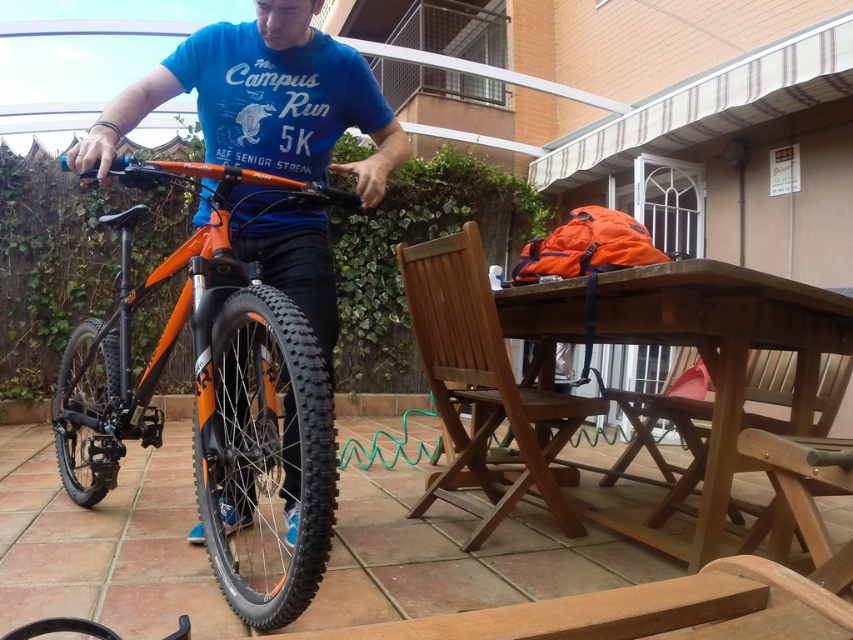
Based on the photo, you are planning to move the orange matte bicycle at center and the brown wooden table at center to different locations. If you want to place them side by side in a space that can only accommodate the larger of the two, which object should you prioritize moving first?

The orange matte bicycle at center occupies less space than the brown wooden table at center, so you should prioritize moving the brown wooden table at center first to ensure it fits in the available space.

You are a photographer trying to capture both the orange matte bicycle at center and the brown wooden table at center in a single shot. Based on their positions, which object will appear larger in the photo?

The orange matte bicycle at center will appear larger in the photo because it is closer to the viewer than the brown wooden table at center.

You are a delivery person who needs to place a large package that requires 35 inches of space between the orange matte bicycle at center and the brown wooden table at center. Is there enough space between them?

The orange matte bicycle at center is 34.01 inches away from the brown wooden table at center. Since the required space is 35 inches, there is insufficient space to place the package between them.